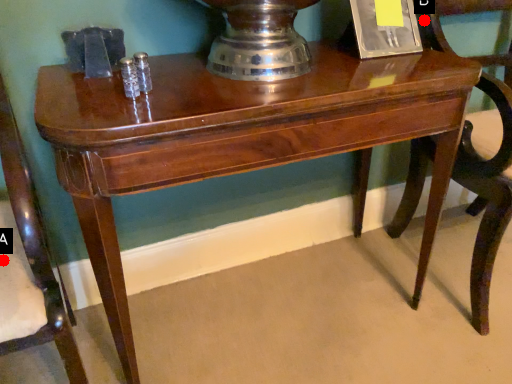
Question: Two points are circled on the image, labeled by A and B beside each circle. Which point is farther from the camera taking this photo?

Choices:
 (A) A is further
 (B) B is further

Answer: (B)